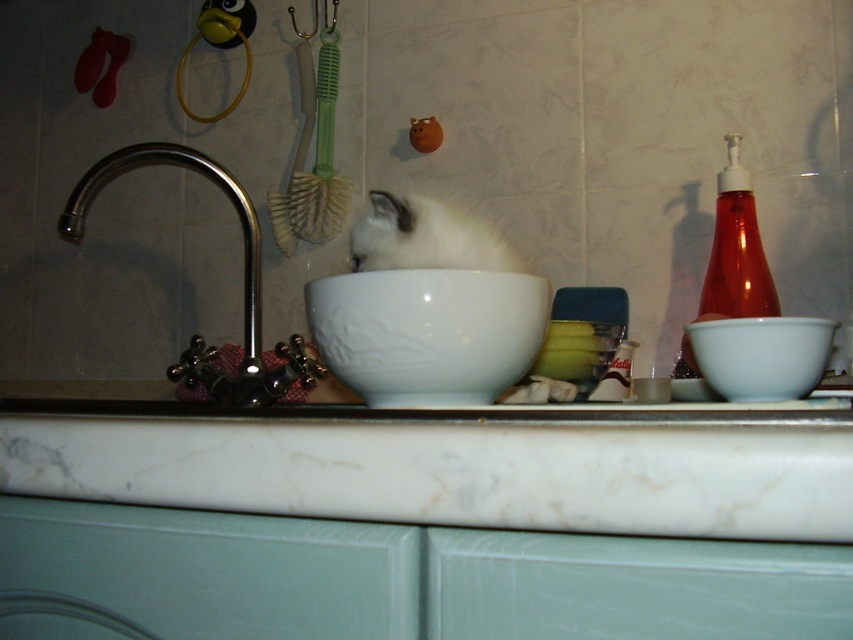
Is white glossy bowl at center positioned behind polished chrome faucet at left?

No, white glossy bowl at center is in front of polished chrome faucet at left.

Is point (523, 308) less distant than point (141, 161)?

Yes, point (523, 308) is in front of point (141, 161).

The width and height of the screenshot is (853, 640). Identify the location of white glossy bowl at center. (427, 332).

Does white marble counter at center appear over polished chrome faucet at left?

No, white marble counter at center is not above polished chrome faucet at left.

Does white marble counter at center have a larger size compared to polished chrome faucet at left?

Actually, white marble counter at center might be smaller than polished chrome faucet at left.

Who is more distant from viewer, (762, 412) or (244, 324)?

Positioned behind is point (244, 324).

Where is `white marble counter at center`? Image resolution: width=853 pixels, height=640 pixels. white marble counter at center is located at coordinates (461, 468).

Is white glossy bowl at right thinner than white fur cat at center?

Yes, white glossy bowl at right is thinner than white fur cat at center.

Is white glossy bowl at right positioned behind white fur cat at center?

No, it is in front of white fur cat at center.

Which is behind, point (723, 356) or point (486, 227)?

The point (486, 227) is behind.

This screenshot has width=853, height=640. In order to click on white glossy bowl at right in this screenshot , I will do `click(761, 355)`.